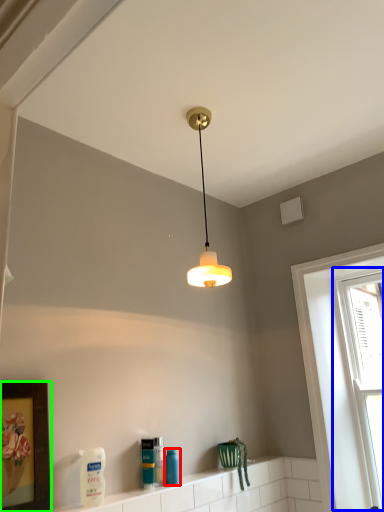
Question: Considering the real-world distances, which object is farthest from cleaning product (highlighted by a red box)? window (highlighted by a blue box) or picture frame (highlighted by a green box)?

Choices:
 (A) window
 (B) picture frame

Answer: (A)